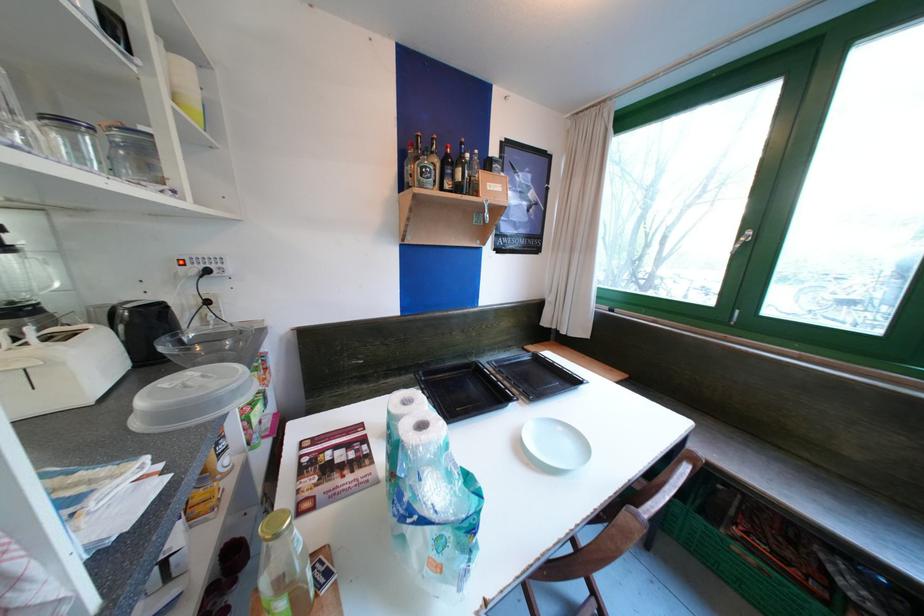
Find where to lift the black kettle handle. Please return your answer as a coordinate pair (x, y).

(123, 318)